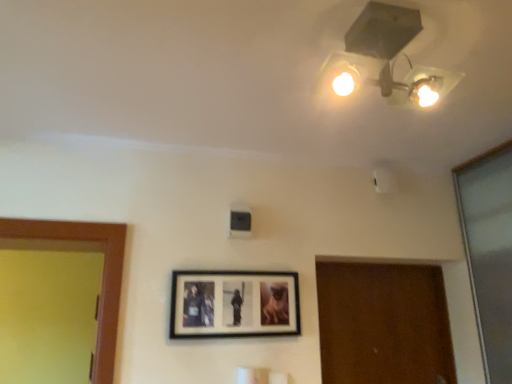
Question: Considering their positions, is matte white lamp at upper center located in front of or behind wooden picture frame at center?

Choices:
 (A) front
 (B) behind

Answer: (A)

Question: From a real-world perspective, is matte white lamp at upper center above or below wooden picture frame at center?

Choices:
 (A) below
 (B) above

Answer: (B)

Question: Would you say matte white lamp at upper center is inside or outside wooden picture frame at center?

Choices:
 (A) inside
 (B) outside

Answer: (B)

Question: In terms of size, does wooden picture frame at center appear bigger or smaller than matte white lamp at upper center?

Choices:
 (A) small
 (B) big

Answer: (A)

Question: Looking at their shapes, would you say wooden picture frame at center is wider or thinner than matte white lamp at upper center?

Choices:
 (A) thin
 (B) wide

Answer: (A)

Question: Is wooden picture frame at center to the left or to the right of matte white lamp at upper center in the image?

Choices:
 (A) left
 (B) right

Answer: (A)

Question: Which is correct: wooden picture frame at center is inside matte white lamp at upper center, or outside of it?

Choices:
 (A) outside
 (B) inside

Answer: (A)